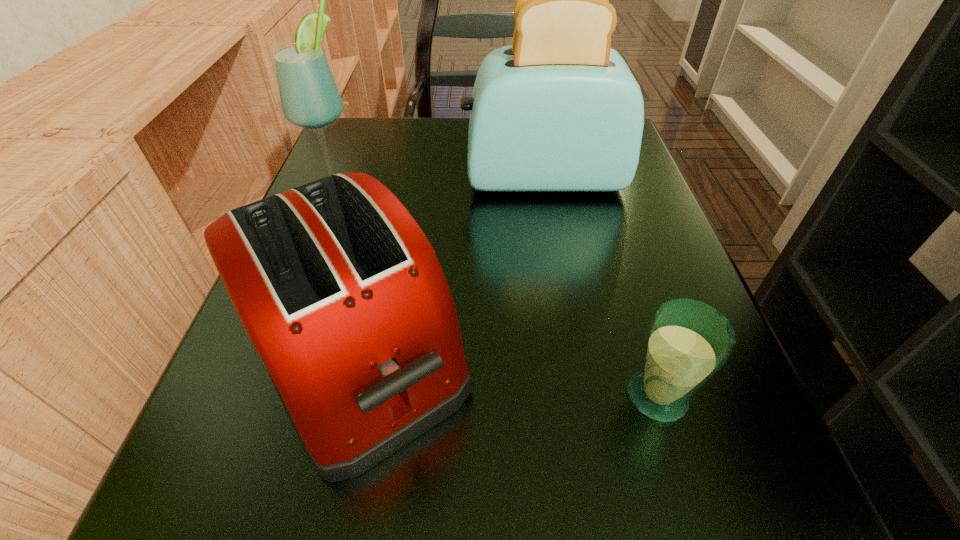
You are a GUI agent. You are given a task and a screenshot of the screen. Output one action in this format:
    pyautogui.click(x=<x>, y=<y>)
    Task: Click on the object located at the far right corner
    
    Given the screenshot: What is the action you would take?
    pyautogui.click(x=558, y=110)

I want to click on vacant space at the far edge of the desktop, so click(x=420, y=125).

In the image, there is a desktop. At what (x,y) coordinates should I click in order to perform the action: click on free region at the near edge. Please return your answer as a coordinate pair (x, y). The image size is (960, 540). Looking at the image, I should click on (596, 535).

Where is `free space at the left edge`? free space at the left edge is located at coordinates (219, 390).

This screenshot has width=960, height=540. In order to click on free region at the right edge of the desktop in this screenshot , I will do `click(583, 247)`.

Find the location of a particular element. vacant space at the far left corner of the desktop is located at coordinates (396, 143).

Find the location of a particular element. Image resolution: width=960 pixels, height=540 pixels. vacant area between the taller toaster and the shorter toaster is located at coordinates (449, 267).

Locate an element on the screen. The height and width of the screenshot is (540, 960). vacant space that is in between the farther toaster and the alcohol is located at coordinates (440, 183).

Locate an element on the screen. free space between the shortest object and the alcohol is located at coordinates (497, 292).

At what (x,y) coordinates should I click in order to perform the action: click on vacant point located between the farther toaster and the alcohol. Please return your answer as a coordinate pair (x, y). Looking at the image, I should click on (440, 183).